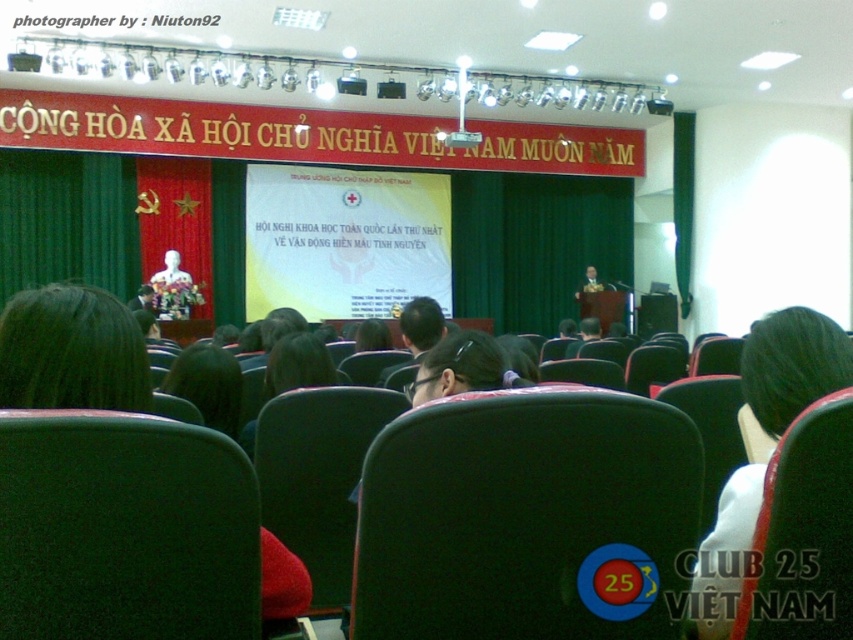
Question: Can you confirm if green fabric chair at center is bigger than matte gold statue at center?

Choices:
 (A) yes
 (B) no

Answer: (B)

Question: Which of these objects is positioned closest to the black fabric chair at center?

Choices:
 (A) green fabric chair at lower left
 (B) matte white statue at center
 (C) matte gold statue at center

Answer: (A)

Question: Which of the following is the farthest from the observer?

Choices:
 (A) (251, 600)
 (B) (281, 474)
 (C) (415, 525)
 (D) (757, 595)

Answer: (B)

Question: Is black fabric chair at center above matte gold statue at center?

Choices:
 (A) yes
 (B) no

Answer: (B)

Question: Is matte white statue at center below matte gold statue at center?

Choices:
 (A) no
 (B) yes

Answer: (B)

Question: Which object appears closest to the camera in this image?

Choices:
 (A) matte white statue at center
 (B) green fabric chair at center
 (C) green fabric chair at lower left

Answer: (C)